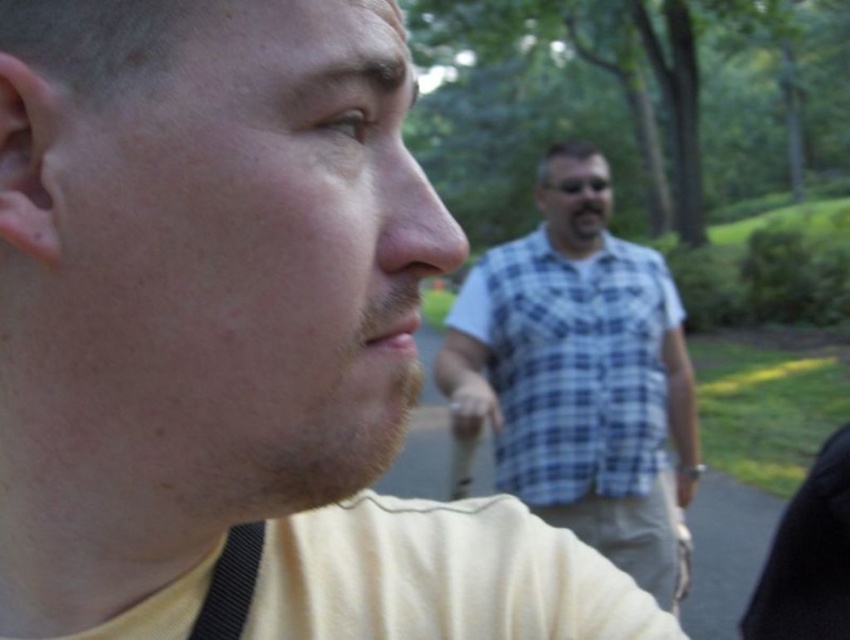
Question: Does blue plaid shirt at center come behind black fabric strap at lower left?

Choices:
 (A) no
 (B) yes

Answer: (B)

Question: Where is blue plaid shirt at center located in relation to black fabric strap at lower left in the image?

Choices:
 (A) right
 (B) left

Answer: (A)

Question: Can you confirm if blue plaid shirt at center is wider than black fabric strap at lower left?

Choices:
 (A) yes
 (B) no

Answer: (A)

Question: Which object appears farthest from the camera in this image?

Choices:
 (A) blue plaid shirt at center
 (B) black fabric strap at lower left

Answer: (A)

Question: Which point is farther to the camera?

Choices:
 (A) (633, 454)
 (B) (197, 611)

Answer: (A)